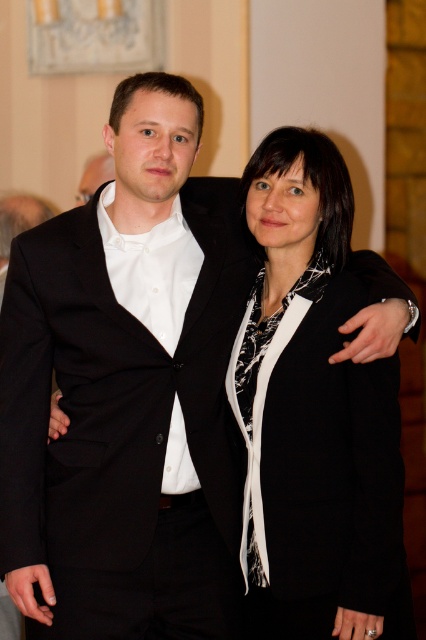
Does black woolen suit at left have a greater width compared to black matte blazer at center?

Yes.

Is black woolen suit at left closer to camera compared to black matte blazer at center?

No, it is behind black matte blazer at center.

Who is more distant from viewer, (219, 628) or (299, 342)?

Point (219, 628)

Identify the location of black woolen suit at left. (121, 432).